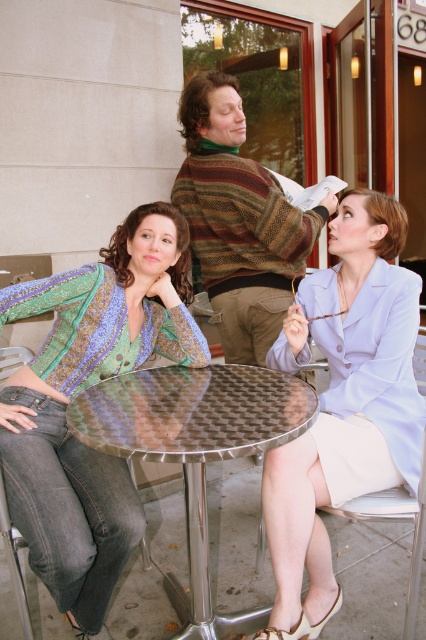
You are a server at the outdoor cafe and need to place a large platter of food on the table. The platter is as wide as the white fabric chair at lower right. Will it fit on the metallic hexagonal table at center?

The metallic hexagonal table at center has a width larger than the white fabric chair at lower right, so the platter will fit on the table.

You are a photographer setting up a shot of the metallic hexagonal table at center and the striped sweater at center. Based on their sizes, which object would require more space to capture in full frame?

The striped sweater at center requires more space because it has a greater width than the metallic hexagonal table at center.

You are standing in front of the striped sweater at center. You want to reach it without moving your feet. Can you do it?

The striped sweater at center is 2.13 meters from viewer, so you cannot reach it without moving your feet since it is too far away.